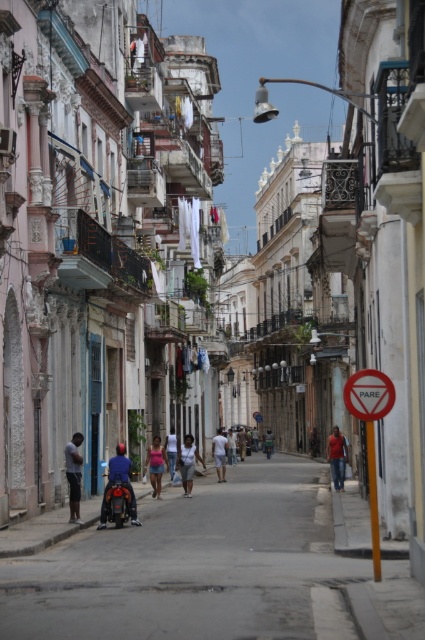
Question: Can you confirm if dark gray shirt at center is wider than light brown leather jacket at center?

Choices:
 (A) no
 (B) yes

Answer: (B)

Question: Considering the relative positions of red plastic sign at right and pink cotton shirt at center in the image provided, where is red plastic sign at right located with respect to pink cotton shirt at center?

Choices:
 (A) right
 (B) left

Answer: (A)

Question: Can you confirm if red plastic sign at right is bigger than light blue jeans at center?

Choices:
 (A) yes
 (B) no

Answer: (A)

Question: Which point is farther to the camera?

Choices:
 (A) light blue jeans at center
 (B) dark gray shirt at center
 (C) dark blue backpack at center
 (D) green fabric shirt at center

Answer: (D)

Question: Which point is closer to the camera taking this photo?

Choices:
 (A) (76, 504)
 (B) (167, 451)
 (C) (314, 433)

Answer: (A)

Question: Considering the real-world distances, which object is farthest from the light blue jeans at center?

Choices:
 (A) pink fabric at center
 (B) red cotton shirt at center

Answer: (B)